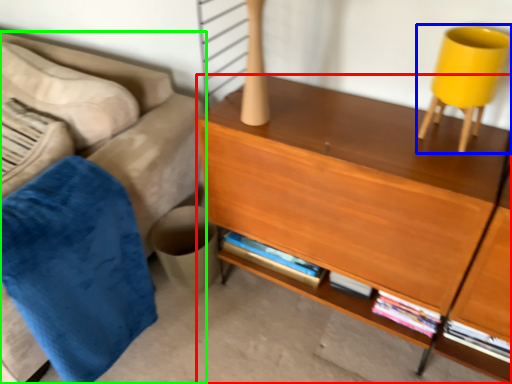
Question: Based on their relative distances, which object is farther from desk (highlighted by a red box)? Choose from swivel chair (highlighted by a blue box) and studio couch (highlighted by a green box).

Choices:
 (A) swivel chair
 (B) studio couch

Answer: (B)